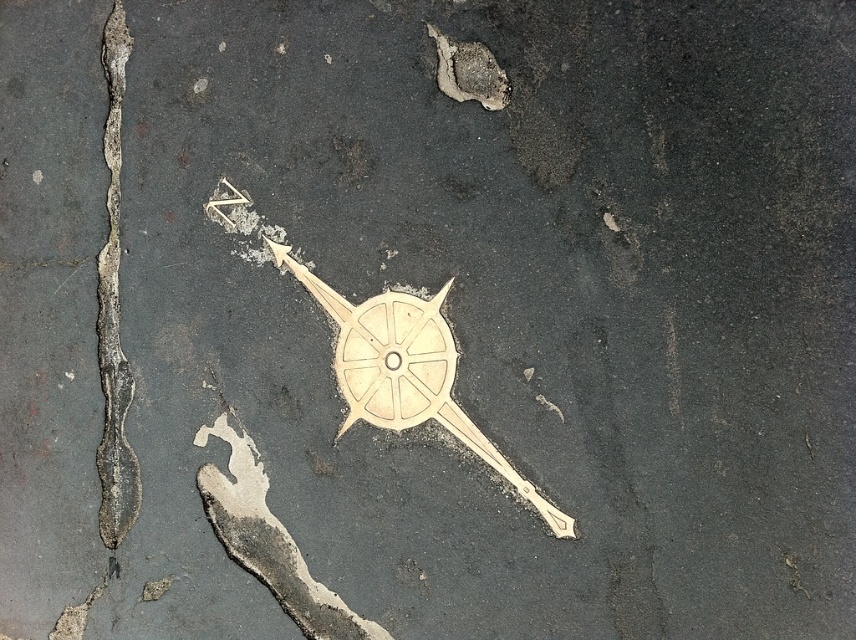
Question: Can you confirm if white matte compass at center is wider than dark gray cracked asphalt at left?

Choices:
 (A) no
 (B) yes

Answer: (B)

Question: Is white matte compass at center bigger than dark gray cracked asphalt at left?

Choices:
 (A) no
 (B) yes

Answer: (B)

Question: Can you confirm if white matte compass at center is positioned below dark gray cracked asphalt at left?

Choices:
 (A) yes
 (B) no

Answer: (A)

Question: Which of the following is the closest to the observer?

Choices:
 (A) (360, 356)
 (B) (110, 451)

Answer: (A)